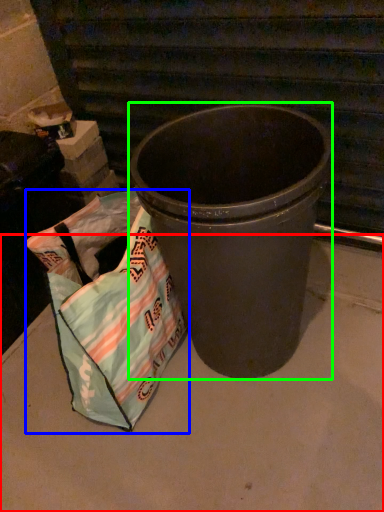
Question: Considering the real-world distances, which object is closest to concrete (highlighted by a red box)? grocery bag (highlighted by a blue box) or waste container (highlighted by a green box).

Choices:
 (A) grocery bag
 (B) waste container

Answer: (A)